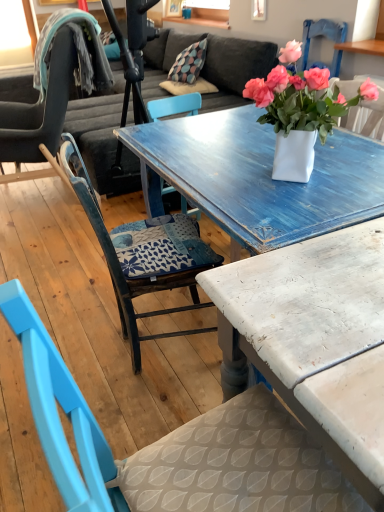
Question: From a real-world perspective, relative to distressed white table at center, is blue painted wood chair at center, the second chair viewed from the left, vertically above or below?

Choices:
 (A) below
 (B) above

Answer: (B)

Question: Based on their sizes in the image, would you say blue painted wood chair at center, which ranks as the second chair in right-to-left order, is bigger or smaller than distressed white table at center?

Choices:
 (A) big
 (B) small

Answer: (B)

Question: Considering the real-world distances, which object is closest to the blue painted wood chair at center, which is counted as the 1th chair, starting from the front?

Choices:
 (A) white matte vase at center
 (B) distressed white table at center
 (C) matte blue chair at left, which appears as the 1th chair when viewed from the left
 (D) blue painted wood chair at center, placed as the second chair when sorted from back to front

Answer: (B)

Question: Which object is the closest to the matte blue chair at left, which is counted as the 3th chair, starting from the front?

Choices:
 (A) blue painted wood chair at center, positioned as the 3th chair in back-to-front order
 (B) blue painted wood chair at center, placed as the second chair when sorted from back to front
 (C) white matte vase at center
 (D) distressed white table at center

Answer: (B)